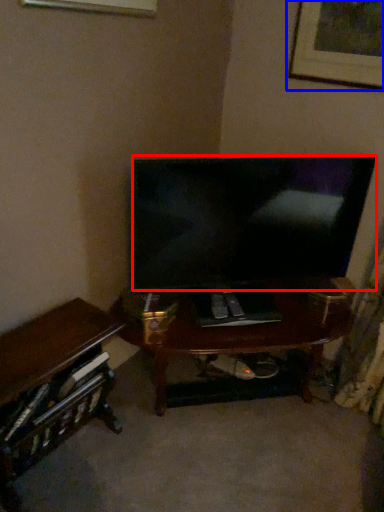
Question: Which of the following is the farthest to the observer, television (highlighted by a red box) or picture frame (highlighted by a blue box)?

Choices:
 (A) television
 (B) picture frame

Answer: (B)